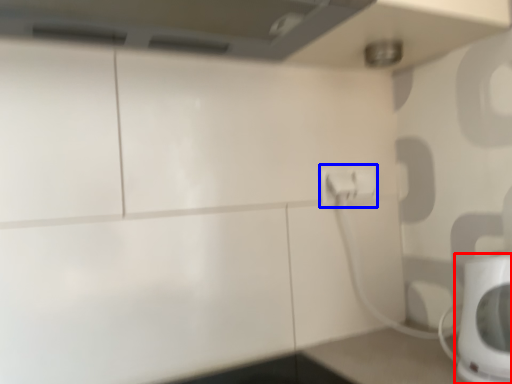
Question: Which of the following is the farthest to the observer, home appliance (highlighted by a red box) or electric outlet (highlighted by a blue box)?

Choices:
 (A) home appliance
 (B) electric outlet

Answer: (B)